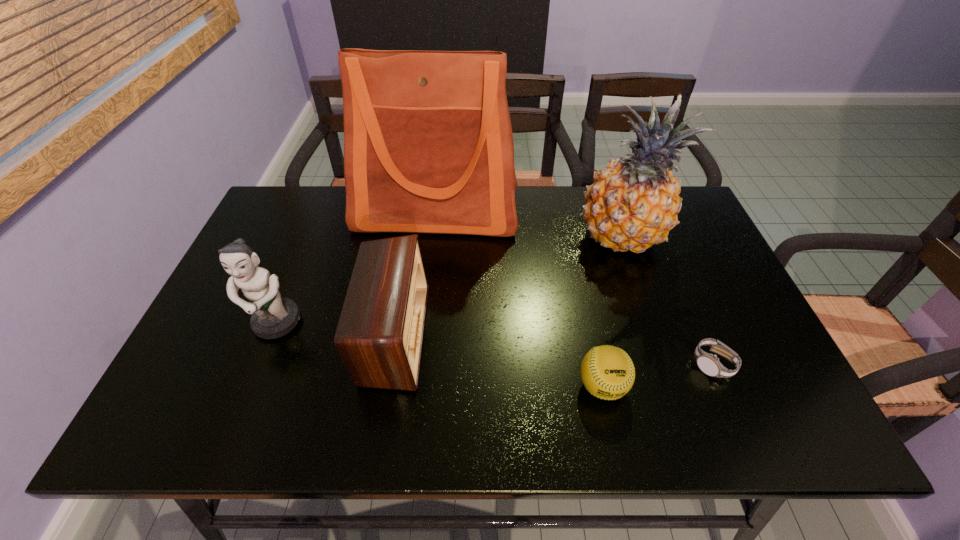
Where is `shopping bag`? shopping bag is located at coordinates (428, 146).

Where is `pineapple`? pineapple is located at coordinates (633, 203).

Find the location of a particular element. figurine is located at coordinates (272, 317).

In order to click on the third tallest object in this screenshot , I will do `click(272, 317)`.

Where is `the third shortest object`? This screenshot has width=960, height=540. the third shortest object is located at coordinates (380, 333).

Where is `the second shortest object`? This screenshot has height=540, width=960. the second shortest object is located at coordinates (607, 372).

The height and width of the screenshot is (540, 960). I want to click on watch, so click(x=709, y=364).

The width and height of the screenshot is (960, 540). Find the location of `free space located on the left of the shopping bag`. free space located on the left of the shopping bag is located at coordinates (290, 212).

Find the location of a particular element. Image resolution: width=960 pixels, height=540 pixels. free spot located on the front of the pineapple is located at coordinates (665, 373).

Locate an element on the screen. The height and width of the screenshot is (540, 960). free space located 0.100m on the front-facing side of the fourth shortest object is located at coordinates (252, 384).